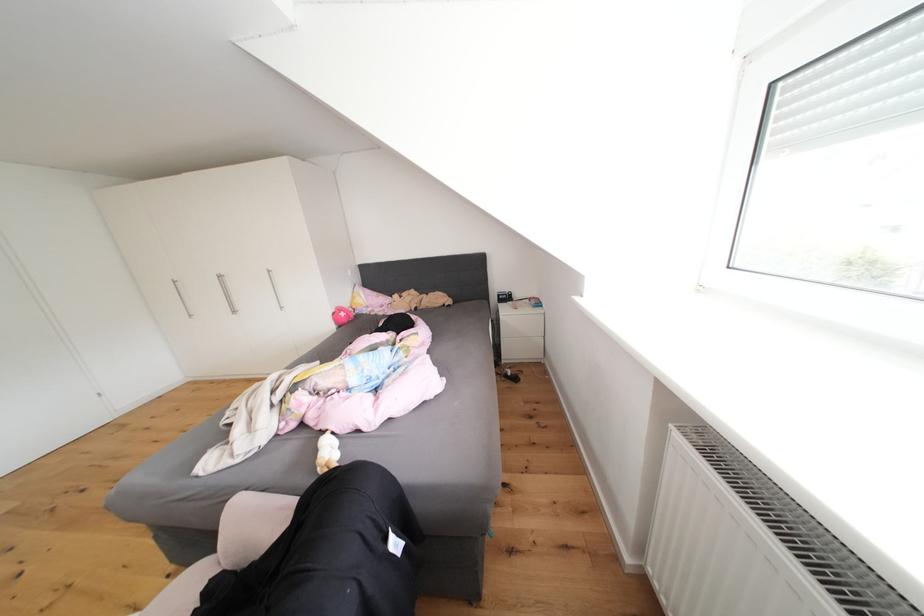
I want to click on drawer handle, so click(x=226, y=293).